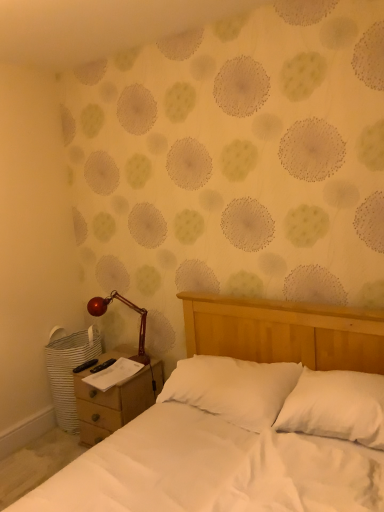
Question: From a real-world perspective, is white soft pillow at center, placed as the 1th pillow when sorted from left to right, above or below white soft pillow at center, the first pillow from the right?

Choices:
 (A) below
 (B) above

Answer: (A)

Question: Considering their positions, is white soft pillow at center, the second pillow when ordered from right to left, located in front of or behind white soft pillow at center, which appears as the 2th pillow when viewed from the left?

Choices:
 (A) front
 (B) behind

Answer: (B)

Question: Estimate the real-world distances between objects in this image. Which object is closer to the white soft pillow at center, which appears as the 2th pillow when viewed from the left?

Choices:
 (A) shiny red metal lamp at left
 (B) white soft pillow at center, the second pillow when ordered from right to left
 (C) wooden nightstand at lower left

Answer: (B)

Question: Considering the real-world distances, which object is farthest from the white soft pillow at center, placed as the 1th pillow when sorted from left to right?

Choices:
 (A) white soft pillow at center, the first pillow from the right
 (B) shiny red metal lamp at left
 (C) wooden nightstand at lower left

Answer: (B)